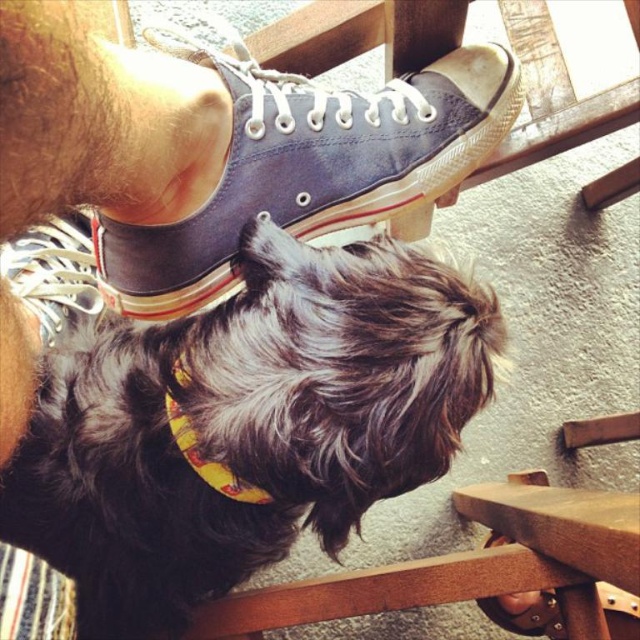
You are a photographer trying to capture a photo of the black fuzzy dog at lower left and the blue canvas shoe at center. Based on their positions, which object is located more to the left side of the image?

The black fuzzy dog at lower left is positioned on the left side of blue canvas shoe at center, so it is more to the left side of the image.